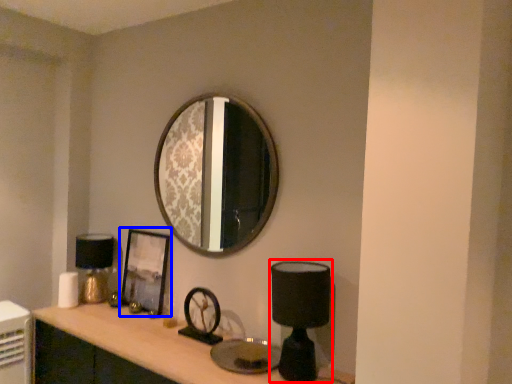
Question: Which point is further to the camera, table lamp (highlighted by a red box) or picture frame (highlighted by a blue box)?

Choices:
 (A) table lamp
 (B) picture frame

Answer: (B)